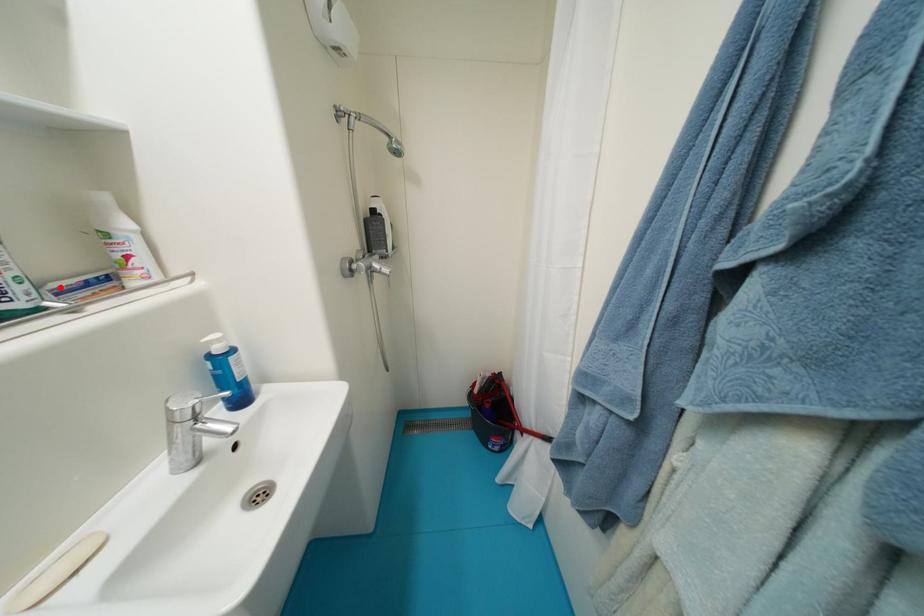
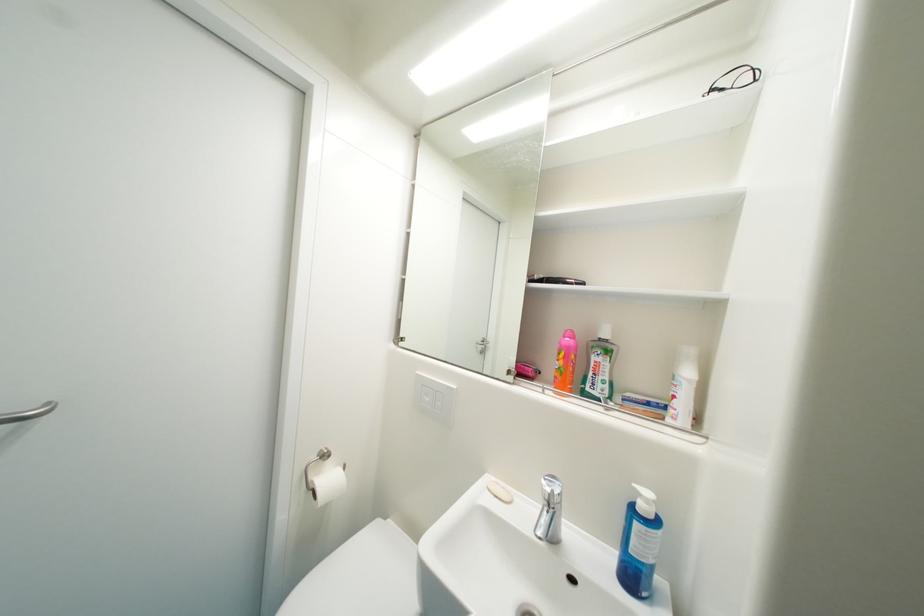
Where in the second image is the point corresponding to the highlighted location from the first image?

(635, 397)